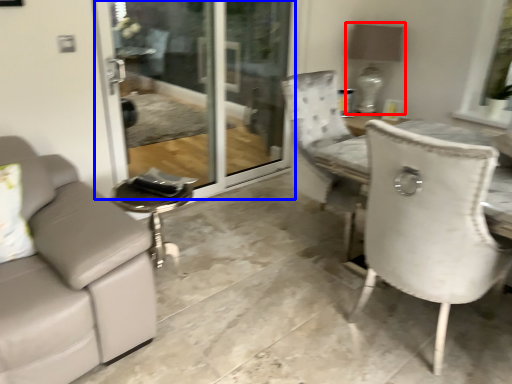
Question: Which object appears farthest to the camera in this image, lamp (highlighted by a red box) or screen door (highlighted by a blue box)?

Choices:
 (A) lamp
 (B) screen door

Answer: (A)